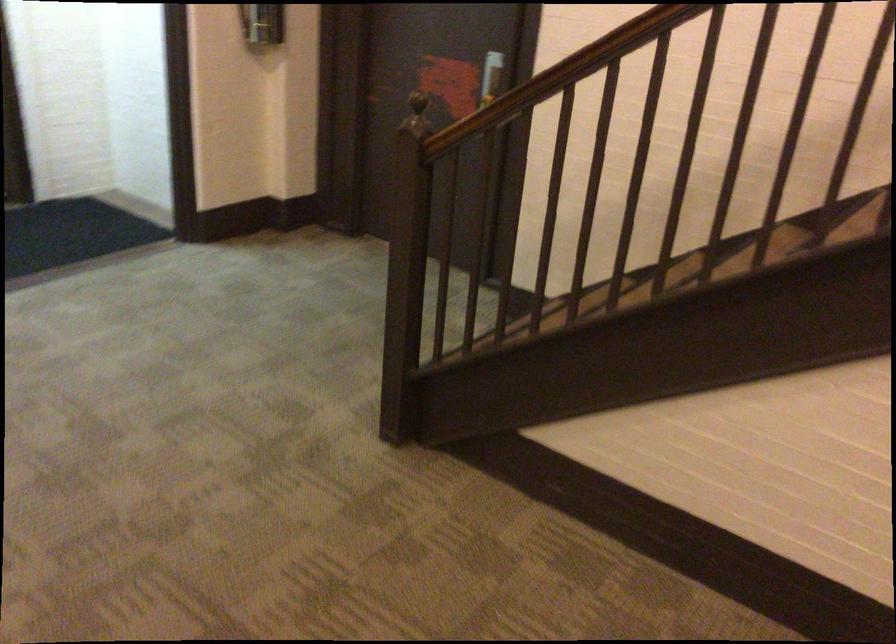
Where would you grasp the brown stair handrail? Please return your answer as a coordinate pair (x, y).

(546, 80)